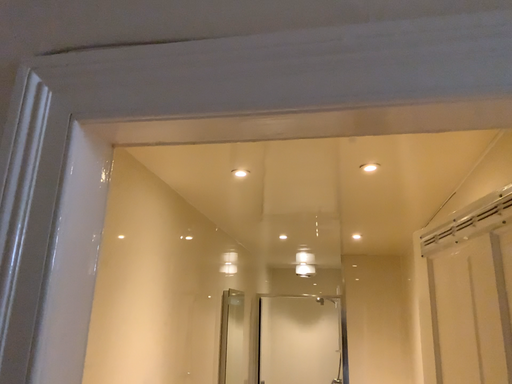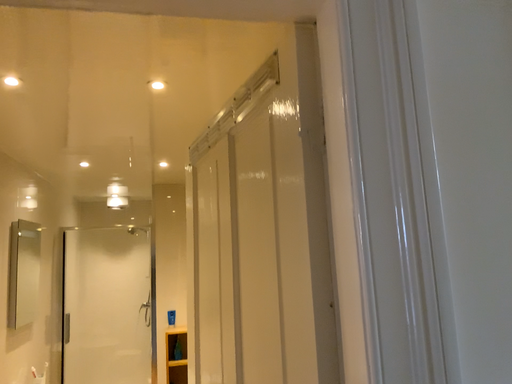
Question: How did the camera likely rotate when shooting the video?

Choices:
 (A) rotated downward
 (B) rotated upward

Answer: (A)